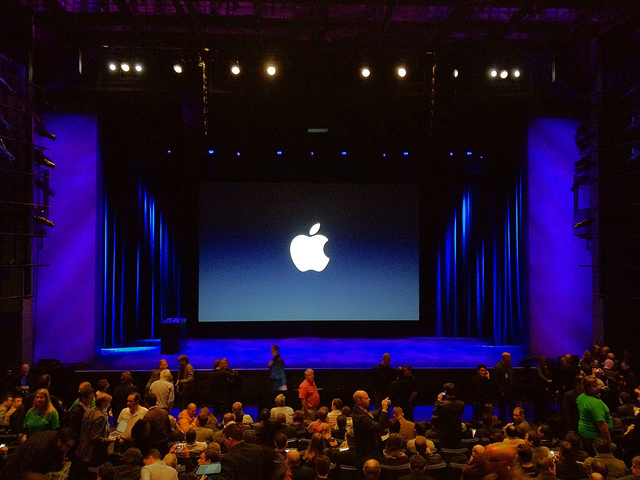
The image size is (640, 480). I want to click on stage, so tap(349, 349).